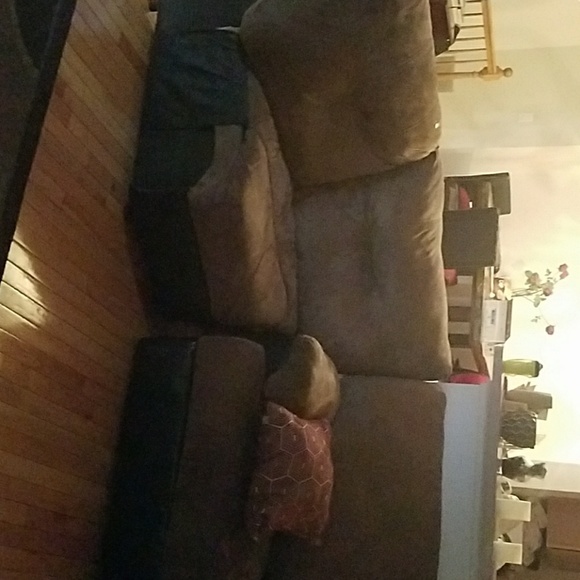
The height and width of the screenshot is (580, 580). Find the location of `light switch`. light switch is located at coordinates (525, 119).